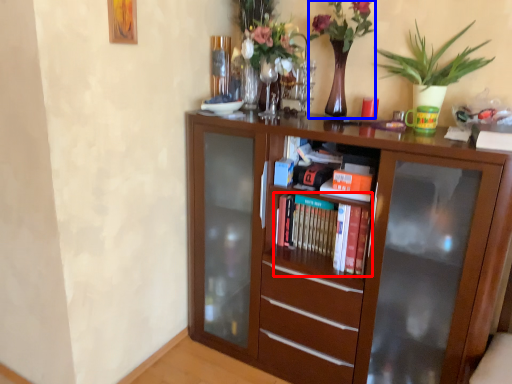
Question: Which object is further to the camera taking this photo, book (highlighted by a red box) or floral arrangement (highlighted by a blue box)?

Choices:
 (A) book
 (B) floral arrangement

Answer: (A)